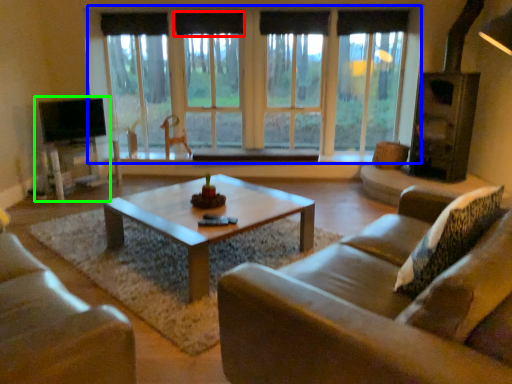
Question: Considering the real-world distances, which object is closest to curtain (highlighted by a red box)? window (highlighted by a blue box) or entertainment center (highlighted by a green box).

Choices:
 (A) window
 (B) entertainment center

Answer: (A)